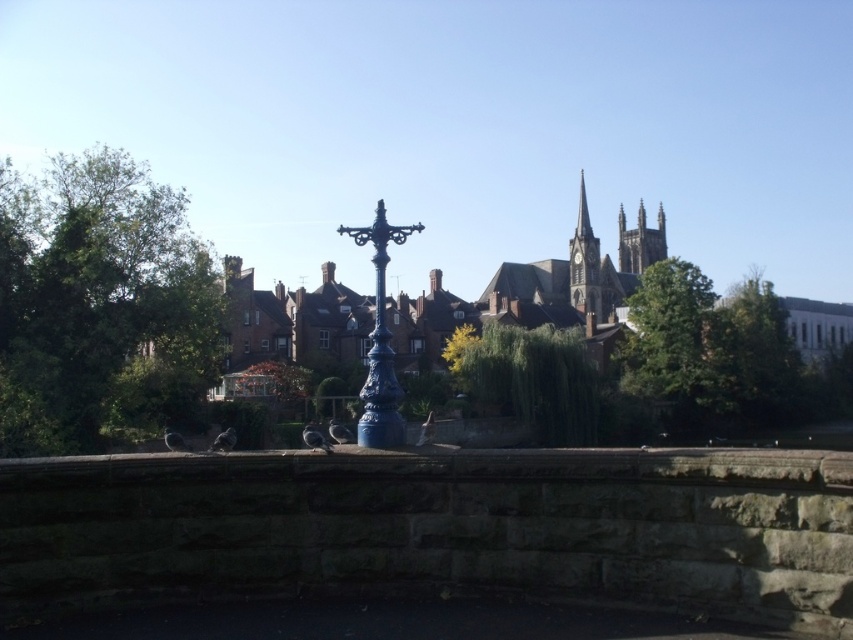
Is point (395, 436) positioned behind point (294, 390)?

That is False.

Can you confirm if blue cast iron lamp post at center is wider than orange leafy tree at center?

Incorrect, blue cast iron lamp post at center's width does not surpass orange leafy tree at center's.

Is point (381, 413) positioned behind point (300, 371)?

No, (381, 413) is closer to viewer.

Locate an element on the screen. The width and height of the screenshot is (853, 640). blue cast iron lamp post at center is located at coordinates (380, 342).

Is smooth stone spire at upper right to the left of orange leafy tree at center from the viewer's perspective?

Incorrect, smooth stone spire at upper right is not on the left side of orange leafy tree at center.

Which is behind, point (593, 244) or point (302, 384)?

Positioned behind is point (593, 244).

Find the location of a particular element. The width and height of the screenshot is (853, 640). smooth stone spire at upper right is located at coordinates (584, 262).

Can you confirm if smooth stone spire at upper right is positioned to the left of smooth stone tower at upper right?

Indeed, smooth stone spire at upper right is positioned on the left side of smooth stone tower at upper right.

This screenshot has width=853, height=640. I want to click on smooth stone spire at upper right, so click(584, 262).

Does point (581, 301) come behind point (619, 252)?

No, (581, 301) is in front of (619, 252).

Locate an element on the screen. The height and width of the screenshot is (640, 853). smooth stone spire at upper right is located at coordinates (584, 262).